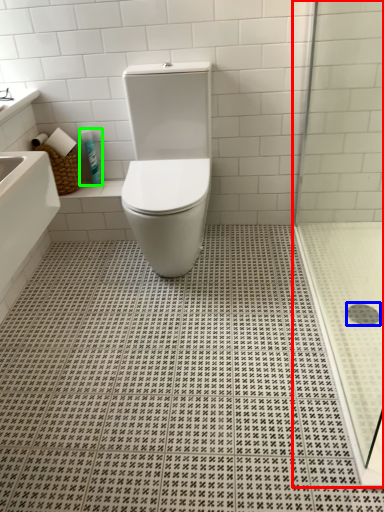
Question: Which object is the closest to the shower door (highlighted by a red box)? Choose among these: drain (highlighted by a blue box) or toiletry (highlighted by a green box).

Choices:
 (A) drain
 (B) toiletry

Answer: (A)